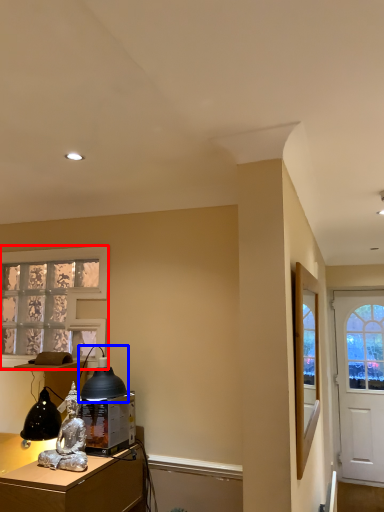
Question: Which object appears farthest to the camera in this image, window (highlighted by a red box) or table lamp (highlighted by a blue box)?

Choices:
 (A) window
 (B) table lamp

Answer: (A)